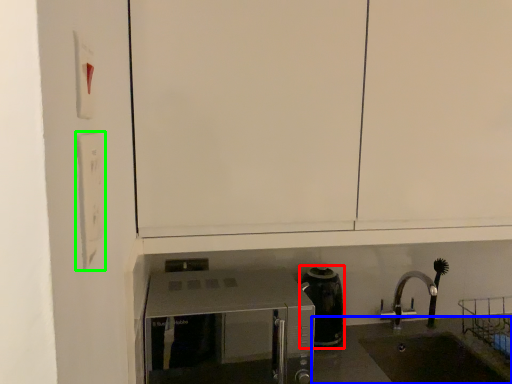
Question: Based on their relative distances, which object is farther from coffeepot (highlighted by a red box)? Choose from counter top (highlighted by a blue box) and light switch (highlighted by a green box).

Choices:
 (A) counter top
 (B) light switch

Answer: (B)